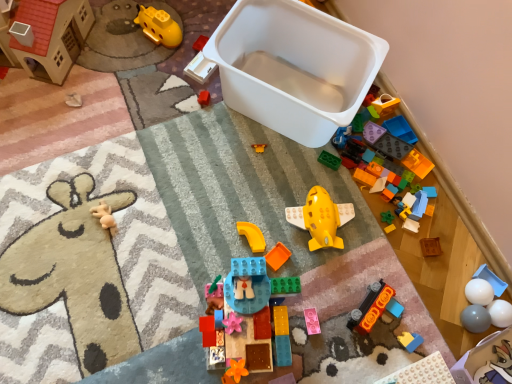
At what (x,y) coordinates should I click in order to perform the action: click on free space that is in between yellow plastic submarine at upper left, which appears as the third toy when viewed from the left, and white plastic tray at upper center, placed as the 13th toy when sorted from right to left. Please return your answer as a coordinate pair (x, y). The height and width of the screenshot is (384, 512). Looking at the image, I should click on (177, 58).